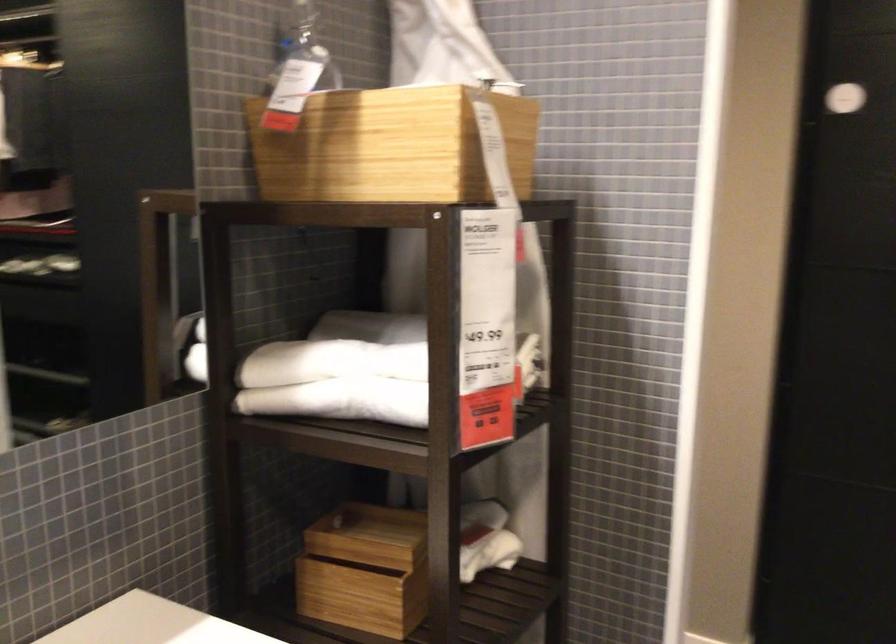
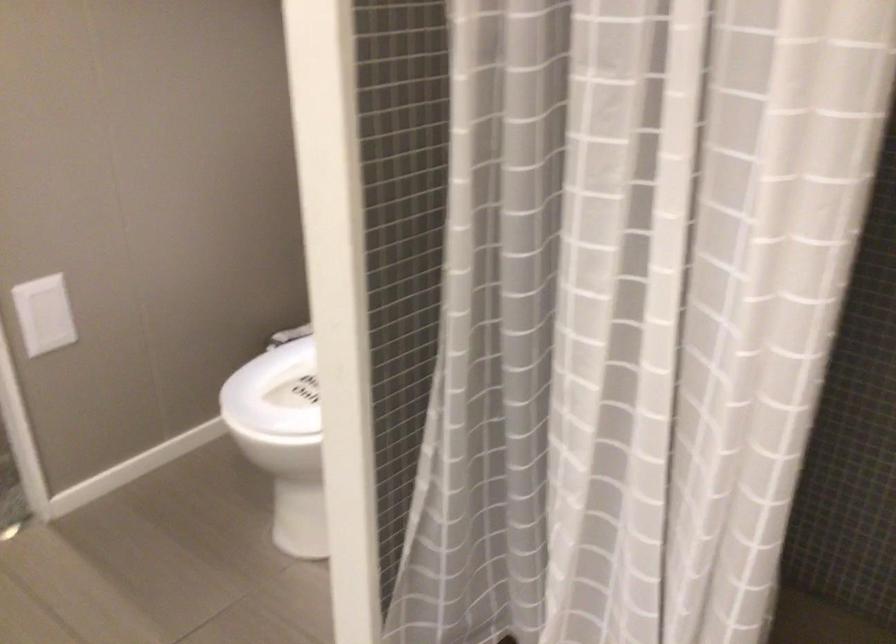
The images are taken continuously from a first-person perspective. In which direction is your viewpoint rotating?

The camera's rotation is toward right-down.